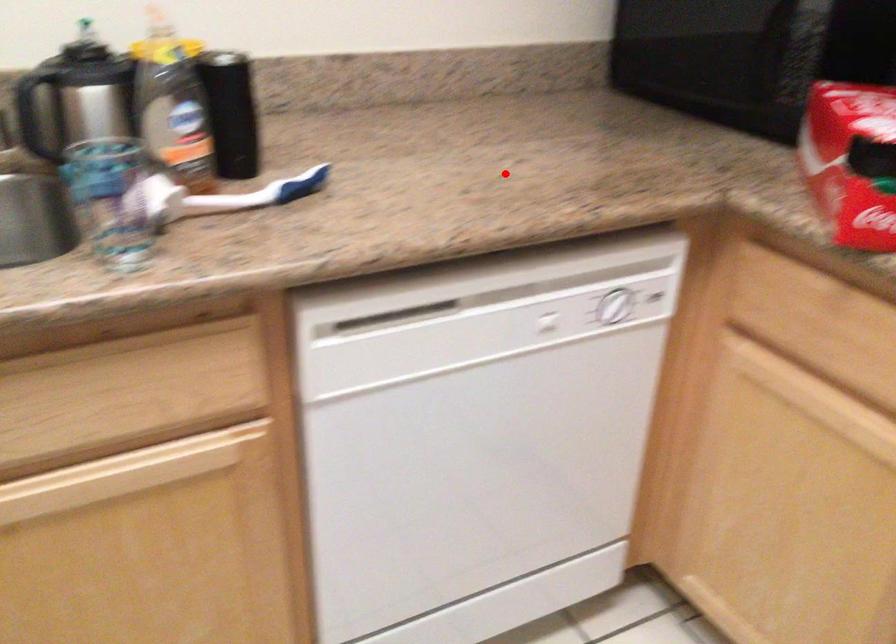
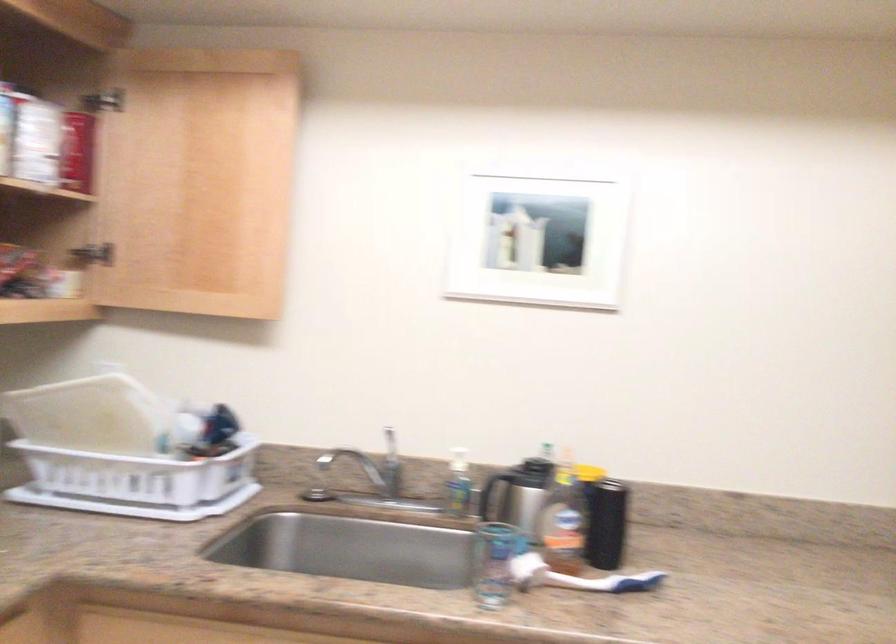
Question: A red point is marked in image1. In image2, is the corresponding 3D point closer to the camera or farther? Reply with the corresponding letter.

Choices:
 (A) The corresponding 3D point is closer.
 (B) The corresponding 3D point is farther.

Answer: (B)